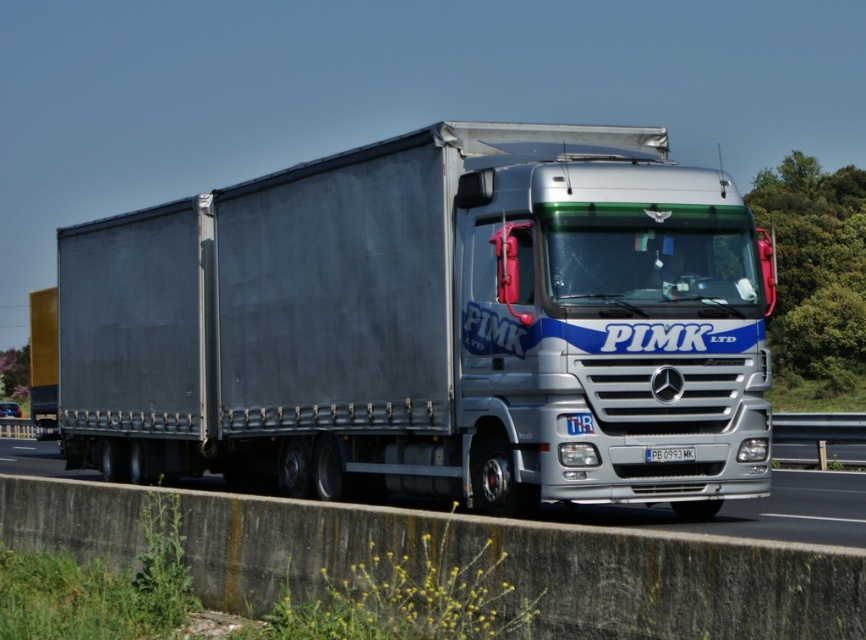
In the scene shown: You are a traffic control officer observing the scene. The silver metallic trailer truck at center is at coordinates approximately 0.509 on the x and 0.498 on the y. If the road is divided into a grid with each cell measuring 0.5 units, can the truck be in the same grid cell as the concrete barrier?

The silver metallic trailer truck at center is located at point (430,324). Since the grid cells are 0.5 units each, the truck falls into the cell spanning from 0.5 to 1.0 on the x and y axes. The concrete barrier is part of the road structure, but its exact coordinates aren not provided. Without knowing the barrier location, we cannot confirm if they share the same grid cell.

You are a traffic officer observing the silver metallic trailer truck at center and the blue plastic license plate at center. Which object is positioned higher in the image?

The silver metallic trailer truck at center is located above the blue plastic license plate at center, so it is positioned higher in the image.

From the picture: You are a traffic officer checking vehicle dimensions. The silver metallic trailer truck at center and the blue plastic license plate at center are in your sight. Which object is larger in size?

The silver metallic trailer truck at center is bigger than the blue plastic license plate at center.